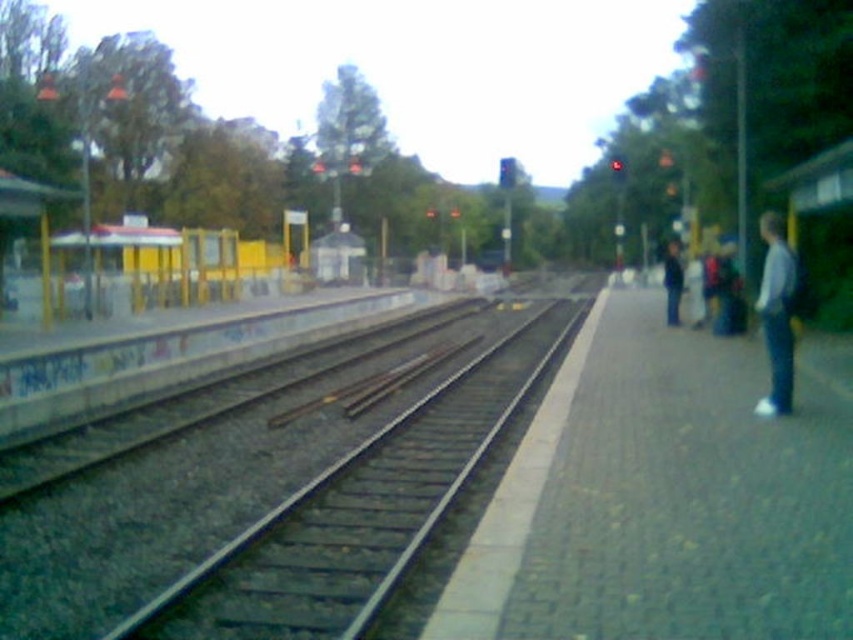
You are a maintenance worker on the railway station platform. You need to inspect both the smooth metal tracks at center and the white fabric jacket at right. Which object should you check first based on their positions?

You should check the smooth metal tracks at center first because it is closer to you than the white fabric jacket at right.

You are a photographer standing on the railway station platform. You want to capture a wide shot of the smooth metal tracks at center and the white fabric jacket at right. Which object will appear larger in your photo?

The smooth metal tracks at center will appear larger in the photo because they are bigger than the white fabric jacket at right.

You are a commuter standing on the platform and notice a white fabric jacket at right. Based on its position, can you determine if it is closer to the left or right side of the platform?

The white fabric jacket at right is located at point 0.492 on the x and 0.911 on the y, so it is closer to the right side of the platform.